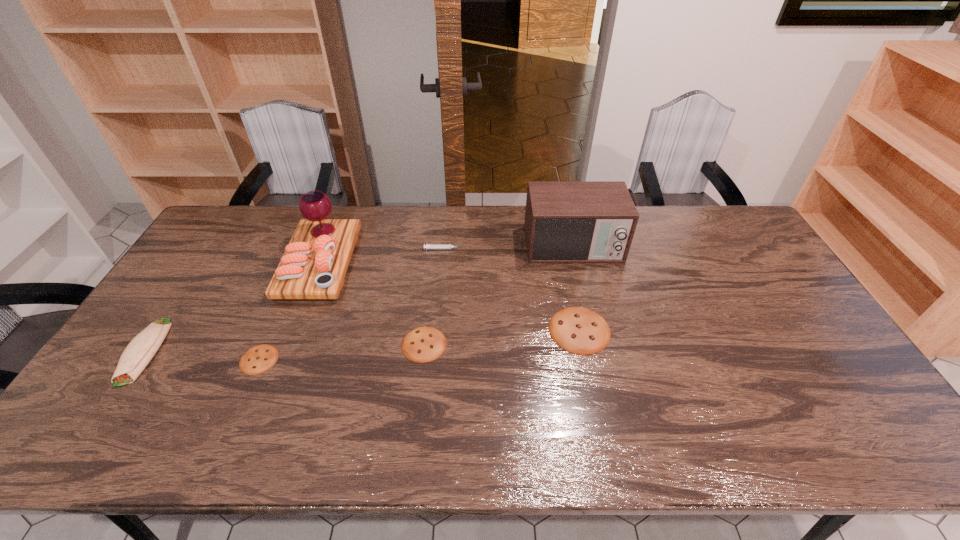
Identify the location of free location located on the right of the shortest cookie. (323, 360).

At what (x,y) coordinates should I click in order to perform the action: click on free point located on the back of the second tallest cookie. Please return your answer as a coordinate pair (x, y). Looking at the image, I should click on (427, 314).

In order to click on free spot located 0.080m on the right of the tallest cookie in this screenshot , I will do `click(638, 330)`.

At what (x,y) coordinates should I click in order to perform the action: click on free space located 0.340m on the front-facing side of the radio receiver. Please return your answer as a coordinate pair (x, y). This screenshot has height=540, width=960. Looking at the image, I should click on (598, 353).

This screenshot has height=540, width=960. What are the coordinates of `free region located 0.260m on the left of the platter` in the screenshot? It's located at (209, 262).

The width and height of the screenshot is (960, 540). Identify the location of vacant space situated at the needle end of the syringe. (497, 249).

I want to click on radio receiver that is at the far edge, so click(x=565, y=221).

Find the location of a particular element. The height and width of the screenshot is (540, 960). platter located in the far edge section of the desktop is located at coordinates (315, 262).

Find the location of a particular element. The image size is (960, 540). syringe at the far edge is located at coordinates (428, 246).

Locate an element on the screen. This screenshot has height=540, width=960. object situated at the near edge is located at coordinates (139, 352).